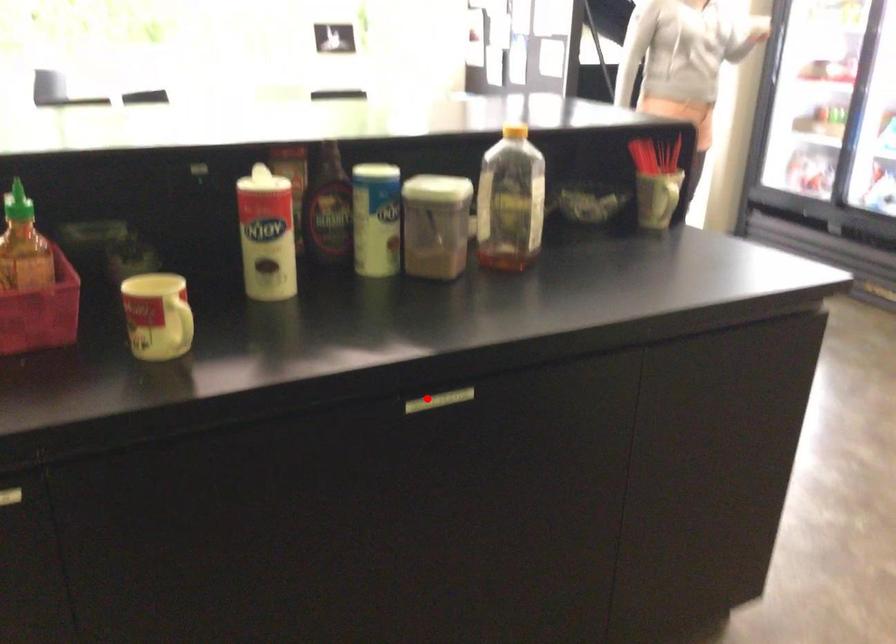
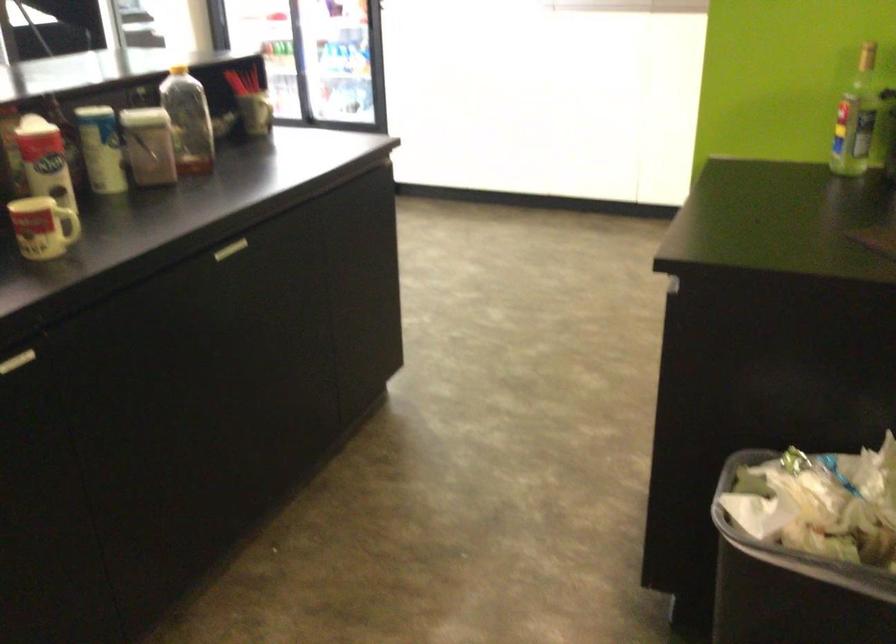
Find the pixel in the second image that matches the highlighted location in the first image.

(229, 249)